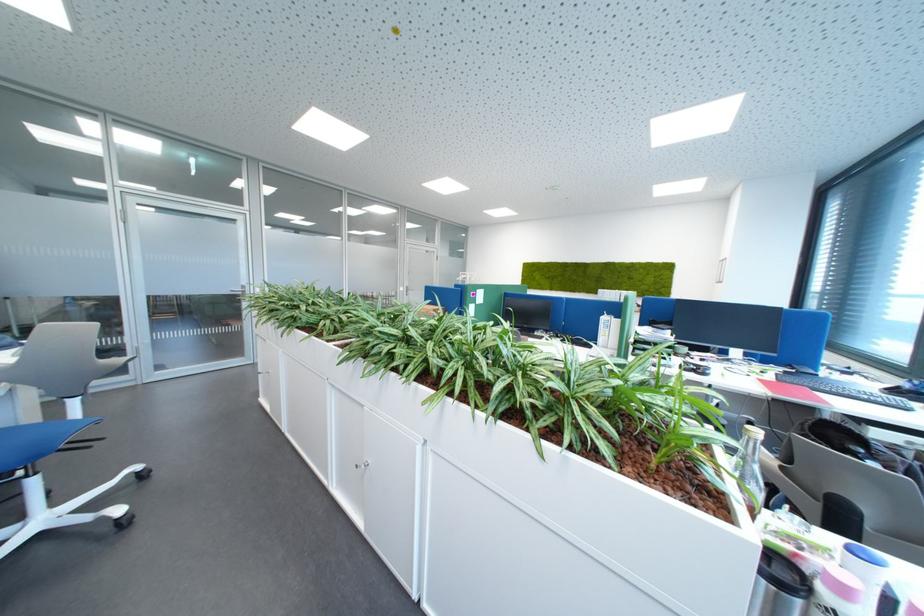
Find where to pull the white cabinet handle. Please return your answer as a coordinate pair (x, y).

(361, 464)